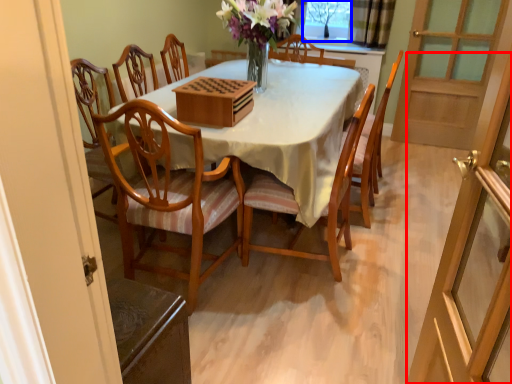
Question: Which object appears farthest to the camera in this image, screen door (highlighted by a red box) or window screen (highlighted by a blue box)?

Choices:
 (A) screen door
 (B) window screen

Answer: (B)